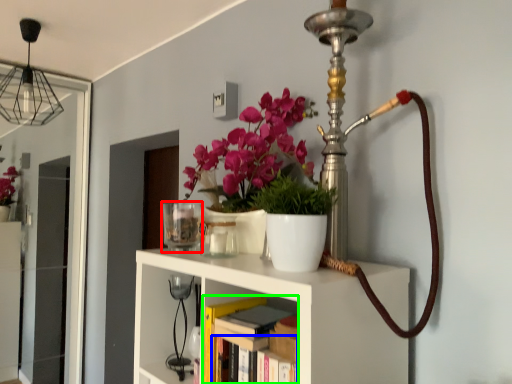
Question: Which is nearer to the candle holder (highlighted by a red box)? book (highlighted by a blue box) or book (highlighted by a green box).

Choices:
 (A) book
 (B) book

Answer: (B)